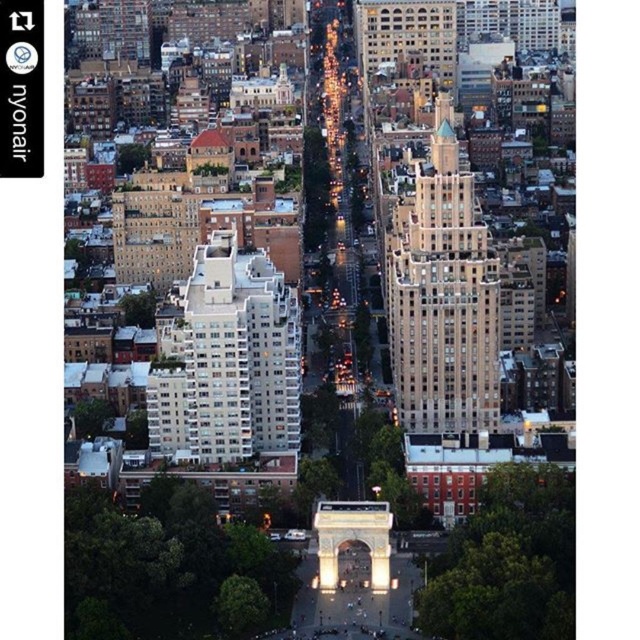
Question: Does beige stone skyscraper at center appear over white concrete building at center-left?

Choices:
 (A) no
 (B) yes

Answer: (B)

Question: Which of the following is the closest to the observer?

Choices:
 (A) (420, 390)
 (B) (150, 410)

Answer: (B)

Question: Does beige stone skyscraper at center have a smaller size compared to white concrete building at center-left?

Choices:
 (A) yes
 (B) no

Answer: (B)

Question: Among these objects, which one is farthest from the camera?

Choices:
 (A) white concrete building at center-left
 (B) beige stone skyscraper at center

Answer: (B)

Question: Is beige stone skyscraper at center smaller than white concrete building at center-left?

Choices:
 (A) yes
 (B) no

Answer: (B)

Question: Which point is farther from the camera taking this photo?

Choices:
 (A) (220, 381)
 (B) (451, 163)

Answer: (B)